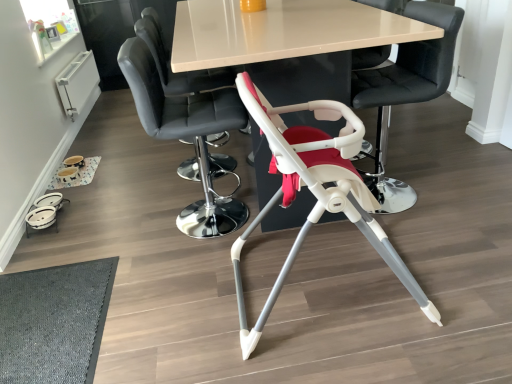
Where is `free space in front of smooth black chair at center, the second chair when ordered from left to right`? free space in front of smooth black chair at center, the second chair when ordered from left to right is located at coordinates (188, 269).